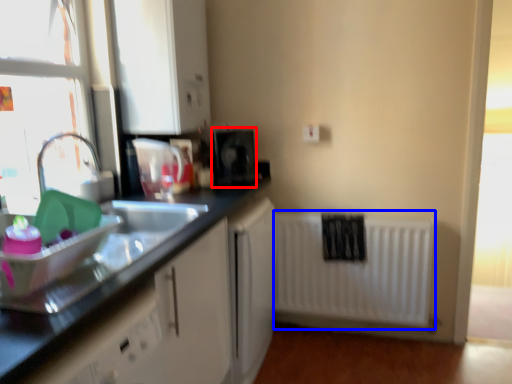
Question: Which of the following is the farthest to the observer, appliance (highlighted by a red box) or radiator (highlighted by a blue box)?

Choices:
 (A) appliance
 (B) radiator

Answer: (B)